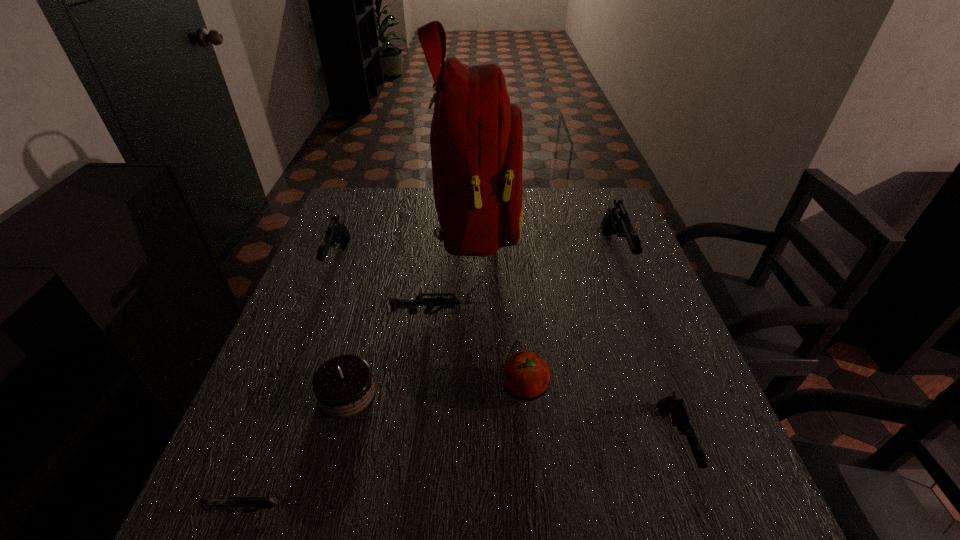
The height and width of the screenshot is (540, 960). Identify the location of free space between the biggest black gun and the smallest black gun. (644, 348).

Locate an element on the screen. free space between the bigger grey gun and the tallest gun is located at coordinates (526, 284).

Find the location of a particular element. empty location between the chocolate chocolate cake and the farther grey gun is located at coordinates (392, 354).

Identify the location of empty space between the farther grey gun and the apple. (480, 352).

Choose which object is the third nearest neighbor to the fourth shortest gun. Please provide its 2D coordinates. Your answer should be formatted as a tuple, i.e. [(x, y)], where the tuple contains the x and y coordinates of a point satisfying the conditions above.

[(344, 386)]

Identify which object is the fifth nearest to the leftmost black gun. Please provide its 2D coordinates. Your answer should be formatted as a tuple, i.e. [(x, y)], where the tuple contains the x and y coordinates of a point satisfying the conditions above.

[(246, 503)]

You are a GUI agent. You are given a task and a screenshot of the screen. Output one action in this format:
    pyautogui.click(x=<x>, y=<y>)
    Task: Click on the gun that is the third closest to the third tallest gun
    The width and height of the screenshot is (960, 540).
    Given the screenshot: What is the action you would take?
    (246, 503)

The width and height of the screenshot is (960, 540). In order to click on gun that is the second closest to the chocolate chocolate cake in this screenshot , I will do `click(246, 503)`.

I want to click on black gun identified as the closest to the second tallest object, so click(680, 417).

You are a GUI agent. You are given a task and a screenshot of the screen. Output one action in this format:
    pyautogui.click(x=<x>, y=<y>)
    Task: Click on the black gun that is the third closest one to the apple
    
    Given the screenshot: What is the action you would take?
    pyautogui.click(x=337, y=233)